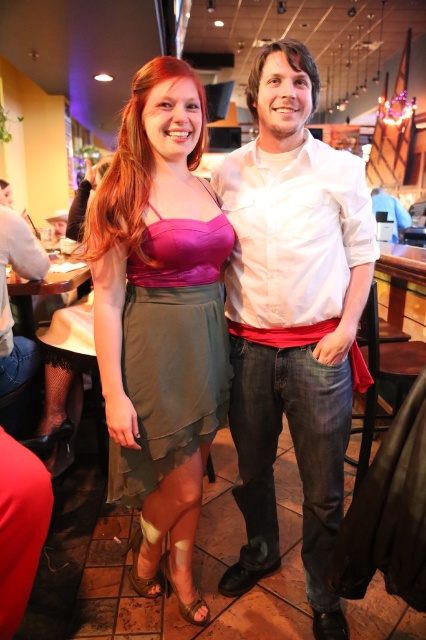
Who is more distant from viewer, (264, 300) or (210, 406)?

The point (210, 406) is behind.

Does white cotton shirt at center have a lesser height compared to satin green skirt at center?

No.

Is point (333, 493) positioned in front of point (138, 285)?

No, (333, 493) is behind (138, 285).

Locate an element on the screen. white cotton shirt at center is located at coordinates [293, 317].

Who is more distant from viewer, (192, 157) or (199, 396)?

The point (192, 157) is more distant.

Can you confirm if satin pink top at center is positioned below satin green skirt at center?

Correct, satin pink top at center is located below satin green skirt at center.

Is point (155, 208) more distant than point (149, 257)?

Yes, point (155, 208) is behind point (149, 257).

Locate an element on the screen. This screenshot has width=426, height=640. satin pink top at center is located at coordinates coord(160,320).

Is white cotton shirt at center to the left of satin pink top at center from the viewer's perspective?

Incorrect, white cotton shirt at center is not on the left side of satin pink top at center.

Is point (232, 417) positioned behind point (118, 401)?

That is True.

Find the location of `white cotton shirt at center`. white cotton shirt at center is located at coordinates (293, 317).